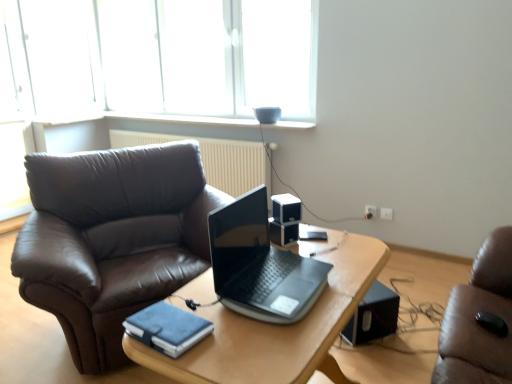
Locate an element on the screen. The height and width of the screenshot is (384, 512). white plastic power outlet at lower right, the 1th power outlet from the right is located at coordinates tap(386, 213).

What do you see at coordinates (286, 208) in the screenshot?
I see `white plastic speaker at center, the third loudspeaker in the right-to-left sequence` at bounding box center [286, 208].

Image resolution: width=512 pixels, height=384 pixels. Describe the element at coordinates (260, 265) in the screenshot. I see `glossy plastic laptop at center` at that location.

Describe the element at coordinates (370, 211) in the screenshot. The image size is (512, 384). I see `white plastic power outlet at right, arranged as the second power outlet when viewed from the right` at that location.

At what (x,y) coordinates should I click in order to perform the action: click on black plastic speaker at center, the second loudspeaker when ordered from top to bottom. Please return your answer as a coordinate pair (x, y). Looking at the image, I should click on (283, 232).

Identify the location of transparent glass window at upper center. This screenshot has height=384, width=512. (158, 57).

This screenshot has height=384, width=512. Identify the location of white plastic power outlet at lower right, the 1th power outlet from the right. [x=386, y=213].

Is beige textured radiator at upper center beside black plastic speaker at center, acting as the 2th loudspeaker starting from the right?

No, beige textured radiator at upper center is not in contact with black plastic speaker at center, acting as the 2th loudspeaker starting from the right.

From their relative heights in the image, would you say beige textured radiator at upper center is taller or shorter than black plastic speaker at center, positioned as the 2th loudspeaker in bottom-to-top order?

beige textured radiator at upper center is taller than black plastic speaker at center, positioned as the 2th loudspeaker in bottom-to-top order.

Between beige textured radiator at upper center and black plastic speaker at center, positioned as the 2th loudspeaker in bottom-to-top order, which one has smaller size?

Smaller between the two is black plastic speaker at center, positioned as the 2th loudspeaker in bottom-to-top order.

Considering the sizes of objects blue leather notebook at lower center and wooden table at center in the image provided, who is wider, blue leather notebook at lower center or wooden table at center?

With larger width is wooden table at center.

Would you say blue leather notebook at lower center is a long distance from wooden table at center?

Actually, blue leather notebook at lower center and wooden table at center are a little close together.

Between blue leather notebook at lower center and wooden table at center, which one has less height?

blue leather notebook at lower center is shorter.

From a real-world perspective, which object stands above the other?

blue leather notebook at lower center, from a real-world perspective.

Relative to black plastic speaker at center, the 2th loudspeaker positioned from the back, is black plastic speaker at lower right, which appears as the 1th loudspeaker when viewed from the right, in front or behind?

Visually, black plastic speaker at lower right, which appears as the 1th loudspeaker when viewed from the right, is located behind black plastic speaker at center, the 2th loudspeaker positioned from the back.

Can you tell me how much black plastic speaker at lower right, placed as the 3th loudspeaker when sorted from top to bottom, and black plastic speaker at center, positioned as the second loudspeaker in left-to-right order, differ in facing direction?

There is a 20.1-degree angle between the facing directions of black plastic speaker at lower right, placed as the 3th loudspeaker when sorted from top to bottom, and black plastic speaker at center, positioned as the second loudspeaker in left-to-right order.

Is black plastic speaker at center, the second loudspeaker when ordered from front to back, located within black plastic speaker at lower right, which is the third loudspeaker in front-to-back order?

No, black plastic speaker at center, the second loudspeaker when ordered from front to back, is not a part of black plastic speaker at lower right, which is the third loudspeaker in front-to-back order.

Which object is positioned more to the right, black plastic speaker at lower right, the 1th loudspeaker from the bottom, or black plastic speaker at center, the second loudspeaker when ordered from front to back?

From the viewer's perspective, black plastic speaker at lower right, the 1th loudspeaker from the bottom, appears more on the right side.

Which of these two, white plastic power outlet at right, placed as the 1th power outlet when sorted from left to right, or black plastic speaker at center, the second loudspeaker when ordered from front to back, is bigger?

With larger size is black plastic speaker at center, the second loudspeaker when ordered from front to back.

The height and width of the screenshot is (384, 512). There is a black plastic speaker at center, positioned as the second loudspeaker in left-to-right order. Identify the location of the 2nd power outlet above it (from the image's perspective). (370, 211).

Is white plastic power outlet at right, arranged as the second power outlet when viewed from the right, in front of or behind black plastic speaker at center, positioned as the 2th loudspeaker in bottom-to-top order, in the image?

In the image, white plastic power outlet at right, arranged as the second power outlet when viewed from the right, appears behind black plastic speaker at center, positioned as the 2th loudspeaker in bottom-to-top order.

Is white plastic power outlet at right, arranged as the second power outlet when viewed from the right, wider than black plastic speaker at center, positioned as the second loudspeaker in left-to-right order?

Incorrect, the width of white plastic power outlet at right, arranged as the second power outlet when viewed from the right, does not surpass that of black plastic speaker at center, positioned as the second loudspeaker in left-to-right order.

Identify the location of window on the left of blue leather notebook at lower center. The width and height of the screenshot is (512, 384). (158, 57).

Who is taller, transparent glass window at upper center or blue leather notebook at lower center?

Standing taller between the two is transparent glass window at upper center.

Considering the positions of point (312, 50) and point (181, 347), is point (312, 50) closer or farther from the camera than point (181, 347)?

Point (312, 50) appears to be farther away from the viewer than point (181, 347).

From the image's perspective, is transparent glass window at upper center above or below blue leather notebook at lower center?

Based on their image positions, transparent glass window at upper center is located above blue leather notebook at lower center.

Is black plastic speaker at lower right, positioned as the 3th loudspeaker in left-to-right order, to the right of transparent glass window at upper center from the viewer's perspective?

Yes, black plastic speaker at lower right, positioned as the 3th loudspeaker in left-to-right order, is to the right of transparent glass window at upper center.

Is point (381, 322) closer or farther from the camera than point (280, 41)?

Point (381, 322) appears to be closer to the viewer than point (280, 41).

Which object is closer to the camera, black plastic speaker at lower right, positioned as the 3th loudspeaker in left-to-right order, or transparent glass window at upper center?

black plastic speaker at lower right, positioned as the 3th loudspeaker in left-to-right order, is more forward.

How many degrees apart are the facing directions of transparent glass window at upper center and white plastic power outlet at lower right, placed as the 2th power outlet when sorted from left to right?

There is a 0.209-degree angle between the facing directions of transparent glass window at upper center and white plastic power outlet at lower right, placed as the 2th power outlet when sorted from left to right.

In the image, is transparent glass window at upper center on the left side or the right side of white plastic power outlet at lower right, the 1th power outlet from the right?

Based on their positions, transparent glass window at upper center is located to the left of white plastic power outlet at lower right, the 1th power outlet from the right.

Measure the distance from transparent glass window at upper center to white plastic power outlet at lower right, the 1th power outlet from the right.

transparent glass window at upper center is 2.46 meters from white plastic power outlet at lower right, the 1th power outlet from the right.

Is transparent glass window at upper center facing towards white plastic power outlet at lower right, placed as the 2th power outlet when sorted from left to right?

No, transparent glass window at upper center is not aimed at white plastic power outlet at lower right, placed as the 2th power outlet when sorted from left to right.

I want to click on radiator on the left side of black plastic speaker at center, positioned as the 2th loudspeaker in bottom-to-top order, so click(x=214, y=159).

Locate an element on the screen. This screenshot has height=384, width=512. notebook behind the wooden table at center is located at coordinates (167, 328).

Based on their spatial positions, is white plastic power outlet at right, arranged as the second power outlet when viewed from the right, or transparent glass window at upper center further from wooden table at center?

transparent glass window at upper center lies further to wooden table at center than the other object.

When comparing their distances from white plastic power outlet at right, arranged as the second power outlet when viewed from the right, does beige textured radiator at upper center or wooden table at center seem closer?

The object closer to white plastic power outlet at right, arranged as the second power outlet when viewed from the right, is beige textured radiator at upper center.

Which object lies further to the anchor point white plastic power outlet at right, placed as the 1th power outlet when sorted from left to right, white plastic power outlet at lower right, placed as the 2th power outlet when sorted from left to right, or glossy plastic laptop at center?

Based on the image, glossy plastic laptop at center appears to be further to white plastic power outlet at right, placed as the 1th power outlet when sorted from left to right.

Consider the image. Estimate the real-world distances between objects in this image. Which object is closer to blue leather notebook at lower center, white plastic speaker at center, the first loudspeaker in the left-to-right sequence, or transparent glass window at upper center?

The object closer to blue leather notebook at lower center is white plastic speaker at center, the first loudspeaker in the left-to-right sequence.

From the image, which object appears to be nearer to white plastic power outlet at right, arranged as the second power outlet when viewed from the right, beige textured radiator at upper center or white plastic speaker at center, the third loudspeaker in the right-to-left sequence?

Among the two, beige textured radiator at upper center is located nearer to white plastic power outlet at right, arranged as the second power outlet when viewed from the right.

Looking at the image, which one is located further to blue leather notebook at lower center, white plastic power outlet at lower right, placed as the 2th power outlet when sorted from left to right, or beige textured radiator at upper center?

beige textured radiator at upper center lies further to blue leather notebook at lower center than the other object.

Consider the image. When comparing their distances from beige textured radiator at upper center, does black plastic speaker at center, the second loudspeaker when ordered from top to bottom, or white plastic speaker at center, the third loudspeaker in the right-to-left sequence, seem further?

black plastic speaker at center, the second loudspeaker when ordered from top to bottom, is further to beige textured radiator at upper center.

Based on the photo, based on their spatial positions, is glossy plastic laptop at center or blue leather notebook at lower center further from black plastic speaker at lower right, placed as the 3th loudspeaker when sorted from top to bottom?

blue leather notebook at lower center is further to black plastic speaker at lower right, placed as the 3th loudspeaker when sorted from top to bottom.

Image resolution: width=512 pixels, height=384 pixels. Find the location of `notebook between wooden table at center and white plastic power outlet at lower right, placed as the 2th power outlet when sorted from left to right, in the front-back direction`. notebook between wooden table at center and white plastic power outlet at lower right, placed as the 2th power outlet when sorted from left to right, in the front-back direction is located at coordinates (167, 328).

Where is `power outlet positioned between glossy plastic laptop at center and white plastic power outlet at right, placed as the 1th power outlet when sorted from left to right, from near to far`? This screenshot has height=384, width=512. power outlet positioned between glossy plastic laptop at center and white plastic power outlet at right, placed as the 1th power outlet when sorted from left to right, from near to far is located at coordinates (386, 213).

Locate an element on the screen. This screenshot has height=384, width=512. window located between blue leather notebook at lower center and white plastic power outlet at right, placed as the 1th power outlet when sorted from left to right, in the depth direction is located at coordinates (158, 57).

The height and width of the screenshot is (384, 512). Identify the location of window between white plastic speaker at center, marked as the 3th loudspeaker in a back-to-front arrangement, and white plastic power outlet at right, placed as the 1th power outlet when sorted from left to right, along the z-axis. (158, 57).